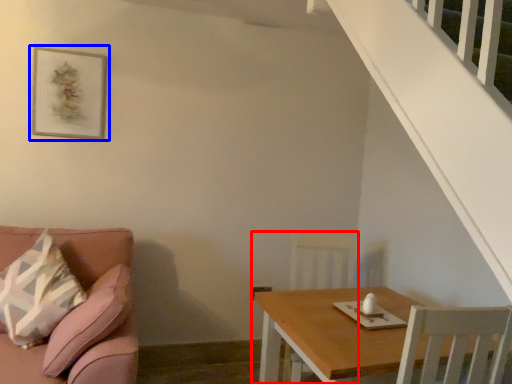
Question: Which object is further to the camera taking this photo, armchair (highlighted by a red box) or picture frame (highlighted by a blue box)?

Choices:
 (A) armchair
 (B) picture frame

Answer: (B)